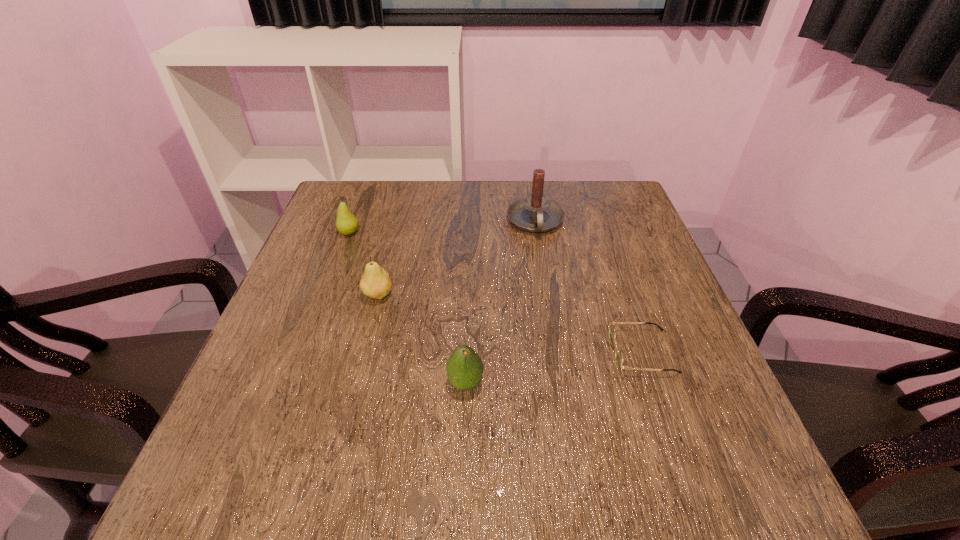
Where is `object that is positioned at the far left corner`? The height and width of the screenshot is (540, 960). object that is positioned at the far left corner is located at coordinates (346, 223).

You are a GUI agent. You are given a task and a screenshot of the screen. Output one action in this format:
    pyautogui.click(x=<x>, y=<y>)
    Task: Click on the vacant space at the far edge of the desktop
    The height and width of the screenshot is (540, 960).
    Given the screenshot: What is the action you would take?
    tap(432, 196)

Locate an element on the screen. This screenshot has width=960, height=540. vacant space at the left edge of the desktop is located at coordinates (340, 279).

This screenshot has width=960, height=540. Identify the location of vacant space at the right edge of the desktop. (611, 291).

Find the location of `free space at the far left corner of the desktop`. free space at the far left corner of the desktop is located at coordinates (376, 200).

In order to click on vacant area at the far right corner in this screenshot , I will do `click(617, 195)`.

Locate an element on the screen. This screenshot has width=960, height=540. vacant area at the near right corner of the desktop is located at coordinates (743, 494).

Image resolution: width=960 pixels, height=540 pixels. What are the coordinates of `free space between the fourth object from left to right and the third object from left to right` in the screenshot? It's located at (500, 302).

Identify the location of vacant region between the third object from right to left and the shortest object. (554, 368).

Locate an element on the screen. This screenshot has width=960, height=540. free spot between the fourth object from right to left and the third object from right to left is located at coordinates (421, 339).